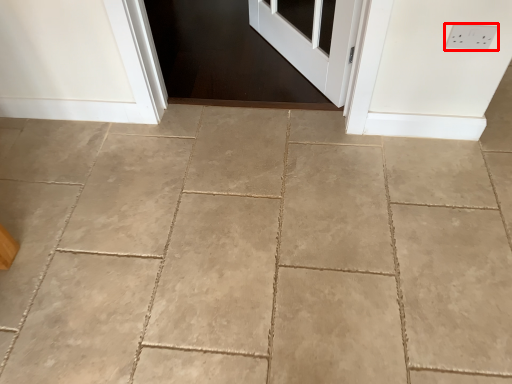
Question: From the image's perspective, what is the correct spatial positioning of electric outlet (annotated by the red box) in reference to concrete?

Choices:
 (A) above
 (B) below

Answer: (A)